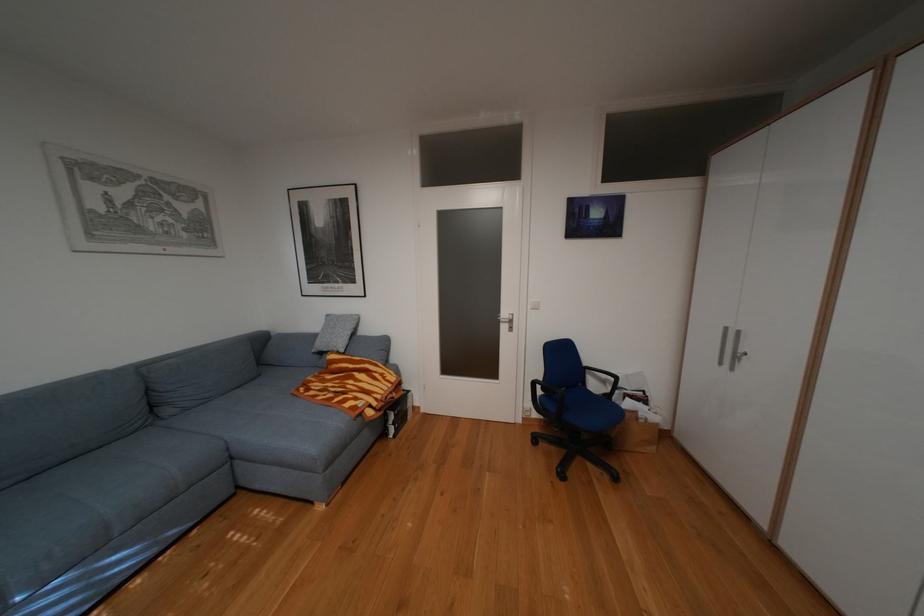
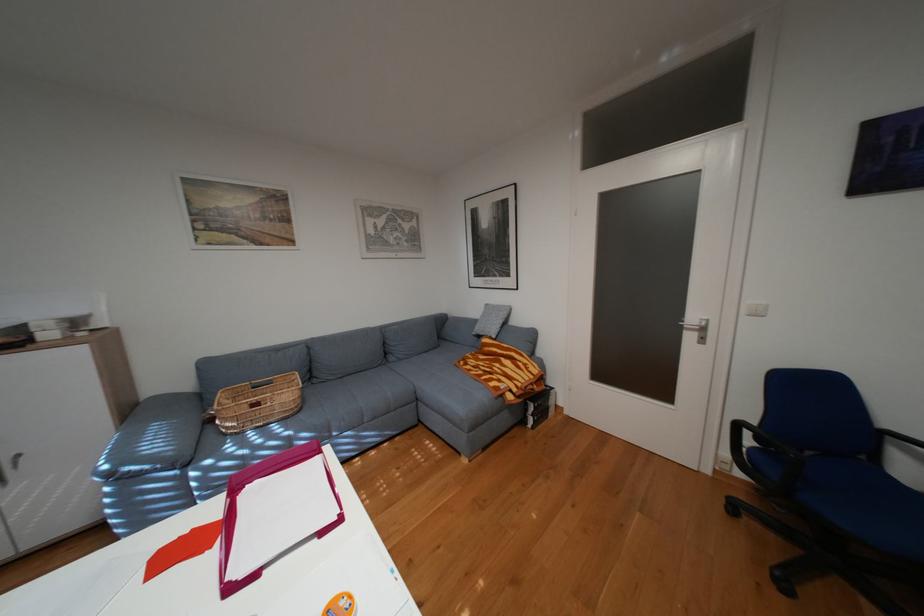
Question: The camera is either moving clockwise (left) or counter-clockwise (right) around the object. The first image is from the beginning of the video and the second image is from the end. Is the camera moving left or right when shooting the video?

Choices:
 (A) Left
 (B) Right

Answer: (B)